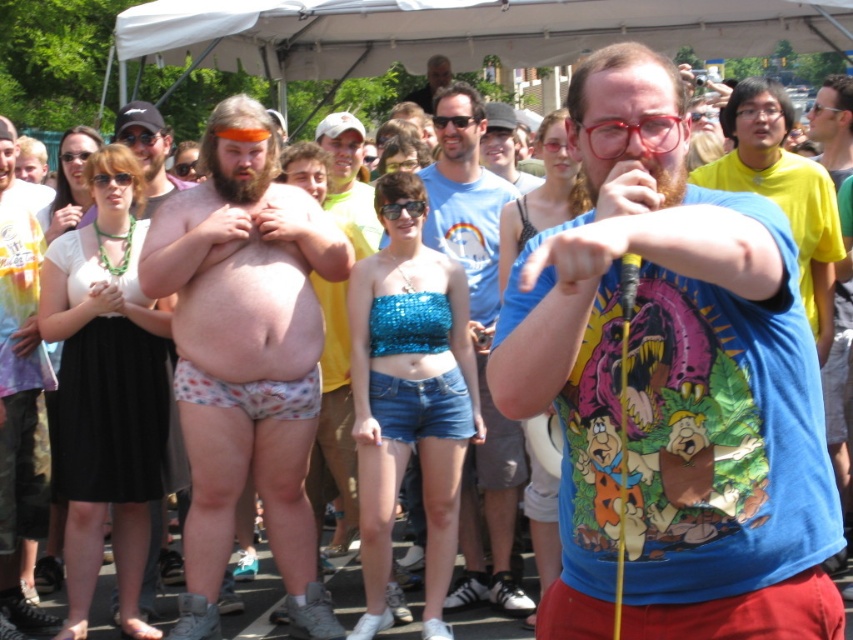
Question: Considering the relative positions of blue t-shirt at center and matte black shirt at upper center in the image provided, where is blue t-shirt at center located with respect to matte black shirt at upper center?

Choices:
 (A) right
 (B) left

Answer: (A)

Question: Does white tie-dye shirt at center appear on the left side of yellow t-shirt at upper right?

Choices:
 (A) no
 (B) yes

Answer: (B)

Question: Which object is positioned farthest from the floral-patterned fabric underwear at center?

Choices:
 (A) yellow t-shirt at upper right
 (B) blue cotton t-shirt at center

Answer: (B)

Question: In this image, where is blue cotton t-shirt at center located relative to matte black shirt at upper center?

Choices:
 (A) below
 (B) above

Answer: (A)

Question: Which object is farther from the camera taking this photo?

Choices:
 (A) white tie-dye shirt at center
 (B) blue cotton t-shirt at center

Answer: (A)

Question: Which point is farther from the camera taking this photo?

Choices:
 (A) (291, 451)
 (B) (19, 417)
 (C) (785, 529)
 (D) (492, 586)

Answer: (D)